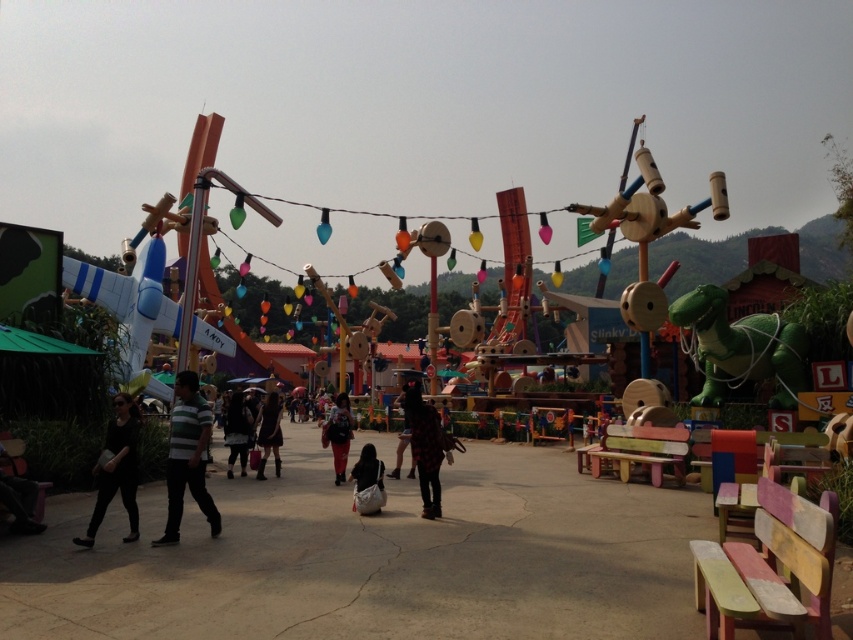
Question: Does black checkered shirt at center lie behind black matte bag at center?

Choices:
 (A) yes
 (B) no

Answer: (B)

Question: Is dark gray fabric coat at center smaller than dark gray fabric dress at center?

Choices:
 (A) no
 (B) yes

Answer: (B)

Question: Which point is closer to the camera taking this photo?

Choices:
 (A) (236, 419)
 (B) (338, 476)
 (C) (177, 456)

Answer: (C)

Question: Does black matte pants at lower left appear over black checkered shirt at center?

Choices:
 (A) yes
 (B) no

Answer: (A)

Question: Which object is the farthest from the dark gray fabric dress at center?

Choices:
 (A) matte black backpack at center
 (B) black matte bag at center
 (C) striped fabric shirt at center
 (D) black checkered shirt at center

Answer: (C)

Question: Considering the real-world distances, which object is farthest from the dark gray fabric dress at center?

Choices:
 (A) black matte bag at center
 (B) matte black backpack at center

Answer: (A)